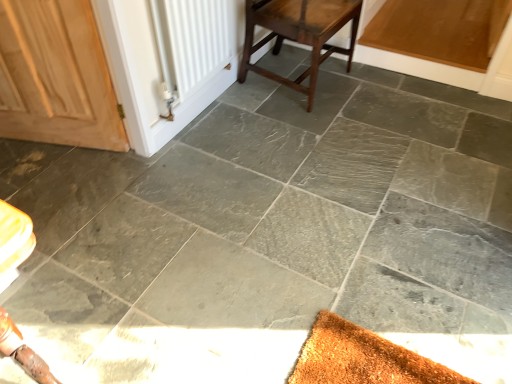
Question: Is dark brown wood stool at center wider than wooden door at left?

Choices:
 (A) no
 (B) yes

Answer: (B)

Question: From a real-world perspective, is dark brown wood stool at center below wooden door at left?

Choices:
 (A) no
 (B) yes

Answer: (B)

Question: Does dark brown wood stool at center have a smaller size compared to wooden door at left?

Choices:
 (A) no
 (B) yes

Answer: (A)

Question: Is dark brown wood stool at center oriented away from wooden door at left?

Choices:
 (A) no
 (B) yes

Answer: (A)

Question: Considering the relative sizes of dark brown wood stool at center and wooden door at left in the image provided, is dark brown wood stool at center taller than wooden door at left?

Choices:
 (A) yes
 (B) no

Answer: (B)

Question: In terms of height, does wooden door at left look taller or shorter compared to white matte radiator at upper left?

Choices:
 (A) tall
 (B) short

Answer: (A)

Question: Relative to white matte radiator at upper left, is wooden door at left in front or behind?

Choices:
 (A) behind
 (B) front

Answer: (B)

Question: Is wooden door at left to the left or to the right of white matte radiator at upper left in the image?

Choices:
 (A) right
 (B) left

Answer: (B)

Question: Considering the positions of wooden door at left and white matte radiator at upper left in the image, is wooden door at left bigger or smaller than white matte radiator at upper left?

Choices:
 (A) small
 (B) big

Answer: (B)

Question: Considering the positions of dark brown wood stool at center and white matte radiator at upper left in the image, is dark brown wood stool at center wider or thinner than white matte radiator at upper left?

Choices:
 (A) thin
 (B) wide

Answer: (B)

Question: Is dark brown wood stool at center bigger or smaller than white matte radiator at upper left?

Choices:
 (A) big
 (B) small

Answer: (A)

Question: From a real-world perspective, is dark brown wood stool at center above or below white matte radiator at upper left?

Choices:
 (A) below
 (B) above

Answer: (A)

Question: From their relative heights in the image, would you say dark brown wood stool at center is taller or shorter than white matte radiator at upper left?

Choices:
 (A) short
 (B) tall

Answer: (B)

Question: Is white matte radiator at upper left spatially inside wooden door at left, or outside of it?

Choices:
 (A) inside
 (B) outside

Answer: (B)

Question: From a real-world perspective, relative to wooden door at left, is white matte radiator at upper left vertically above or below?

Choices:
 (A) below
 (B) above

Answer: (B)